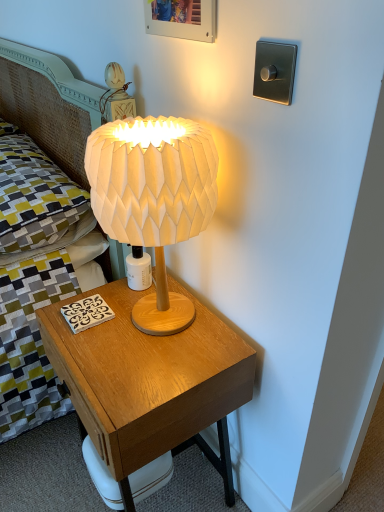
Question: Is yellow-green fabric pillow at upper left to the left of wooden nightstand at center from the viewer's perspective?

Choices:
 (A) no
 (B) yes

Answer: (B)

Question: From a real-world perspective, is yellow-green fabric pillow at upper left positioned under wooden nightstand at center based on gravity?

Choices:
 (A) no
 (B) yes

Answer: (A)

Question: Is yellow-green fabric pillow at upper left touching wooden nightstand at center?

Choices:
 (A) no
 (B) yes

Answer: (A)

Question: From the image's perspective, would you say yellow-green fabric pillow at upper left is shown under wooden nightstand at center?

Choices:
 (A) no
 (B) yes

Answer: (A)

Question: Is yellow-green fabric pillow at upper left far from wooden nightstand at center?

Choices:
 (A) yes
 (B) no

Answer: (B)

Question: Does yellow-green fabric pillow at upper left have a larger size compared to wooden nightstand at center?

Choices:
 (A) no
 (B) yes

Answer: (A)

Question: Is white paper lampshade at center to the left of wooden nightstand at center from the viewer's perspective?

Choices:
 (A) no
 (B) yes

Answer: (A)

Question: From the image's perspective, is white paper lampshade at center on top of wooden nightstand at center?

Choices:
 (A) yes
 (B) no

Answer: (A)

Question: Is white paper lampshade at center beside wooden nightstand at center?

Choices:
 (A) no
 (B) yes

Answer: (A)

Question: Is white paper lampshade at center not close to wooden nightstand at center?

Choices:
 (A) no
 (B) yes

Answer: (A)

Question: Does white paper lampshade at center have a greater height compared to wooden nightstand at center?

Choices:
 (A) yes
 (B) no

Answer: (B)

Question: Does white paper lampshade at center have a smaller size compared to wooden nightstand at center?

Choices:
 (A) no
 (B) yes

Answer: (B)

Question: Can you confirm if wooden nightstand at center is shorter than yellow-green fabric pillow at upper left?

Choices:
 (A) no
 (B) yes

Answer: (A)